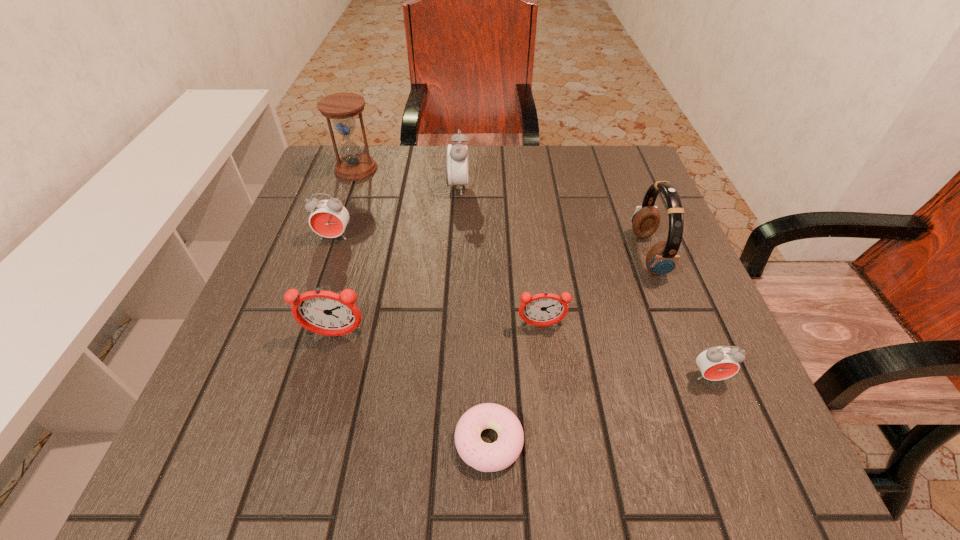
Locate which alarm clock is the closest to the second smallest red alarm clock. Please provide its 2D coordinates. Your answer should be formatted as a tuple, i.e. [(x, y)], where the tuple contains the x and y coordinates of a point satisfying the conditions above.

[(327, 313)]

The image size is (960, 540). What are the coordinates of `the closest red alarm clock to the brown headset` in the screenshot? It's located at (716, 363).

Point out which red alarm clock is positioned as the second nearest to the hourglass. Please provide its 2D coordinates. Your answer should be formatted as a tuple, i.e. [(x, y)], where the tuple contains the x and y coordinates of a point satisfying the conditions above.

[(329, 217)]

Locate an element on the screen. This screenshot has width=960, height=540. vacant area in the image that satisfies the following two spatial constraints: 1. on the face of the tallest alarm clock; 2. on the left side of the nearest object is located at coordinates (443, 441).

Where is `vacant area that satisfies the following two spatial constraints: 1. on the ear cup of the headset; 2. on the front side of the doughnut`? The height and width of the screenshot is (540, 960). vacant area that satisfies the following two spatial constraints: 1. on the ear cup of the headset; 2. on the front side of the doughnut is located at coordinates (720, 441).